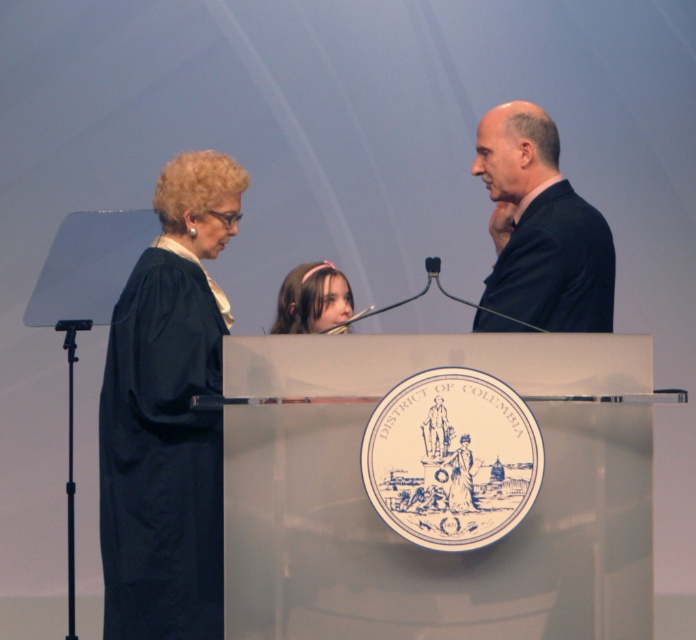
Question: Which point is farther to the camera?

Choices:
 (A) (537, 182)
 (B) (348, 300)
 (C) (129, 589)

Answer: (B)

Question: Which object is positioned closest to the navy blue fabric robe at left?

Choices:
 (A) pink headband at center
 (B) dark blue suit at upper right

Answer: (B)

Question: Can you confirm if navy blue fabric robe at left is wider than dark blue suit at upper right?

Choices:
 (A) no
 (B) yes

Answer: (A)

Question: Which object is positioned closest to the navy blue fabric robe at left?

Choices:
 (A) pink headband at center
 (B) dark blue suit at upper right

Answer: (B)

Question: Does navy blue fabric robe at left appear under dark blue suit at upper right?

Choices:
 (A) no
 (B) yes

Answer: (B)

Question: Does navy blue fabric robe at left appear over dark blue suit at upper right?

Choices:
 (A) yes
 (B) no

Answer: (B)